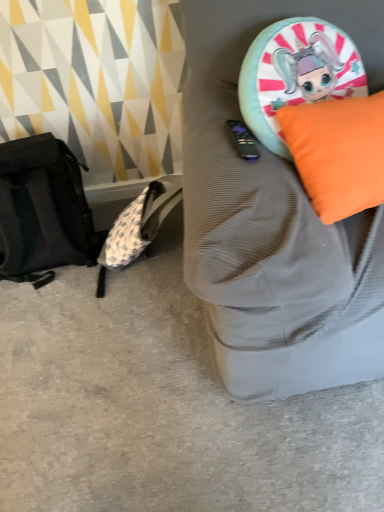
Question: Can you confirm if orange fabric cushion at upper right is wider than orange fabric pillow at upper right?

Choices:
 (A) yes
 (B) no

Answer: (A)

Question: Considering the relative sizes of orange fabric cushion at upper right and orange fabric pillow at upper right in the image provided, is orange fabric cushion at upper right taller than orange fabric pillow at upper right?

Choices:
 (A) yes
 (B) no

Answer: (A)

Question: From the image's perspective, is orange fabric cushion at upper right below orange fabric pillow at upper right?

Choices:
 (A) yes
 (B) no

Answer: (B)

Question: Is orange fabric cushion at upper right beside orange fabric pillow at upper right?

Choices:
 (A) no
 (B) yes

Answer: (A)

Question: From the image's perspective, is orange fabric cushion at upper right over orange fabric pillow at upper right?

Choices:
 (A) no
 (B) yes

Answer: (B)

Question: Does orange fabric cushion at upper right have a lesser height compared to orange fabric pillow at upper right?

Choices:
 (A) no
 (B) yes

Answer: (A)

Question: Would you say black fabric messenger bag at left is a long distance from black fabric backpack at left?

Choices:
 (A) no
 (B) yes

Answer: (A)

Question: Can black fabric backpack at left be found inside black fabric messenger bag at left?

Choices:
 (A) no
 (B) yes

Answer: (A)

Question: Does black fabric messenger bag at left come in front of black fabric backpack at left?

Choices:
 (A) no
 (B) yes

Answer: (A)

Question: Can you confirm if black fabric messenger bag at left is bigger than black fabric backpack at left?

Choices:
 (A) no
 (B) yes

Answer: (A)

Question: Does black fabric messenger bag at left have a greater width compared to black fabric backpack at left?

Choices:
 (A) yes
 (B) no

Answer: (B)

Question: Is black fabric messenger bag at left outside of black fabric backpack at left?

Choices:
 (A) yes
 (B) no

Answer: (A)

Question: Is black fabric backpack at left positioned far away from orange fabric cushion at upper right?

Choices:
 (A) no
 (B) yes

Answer: (A)